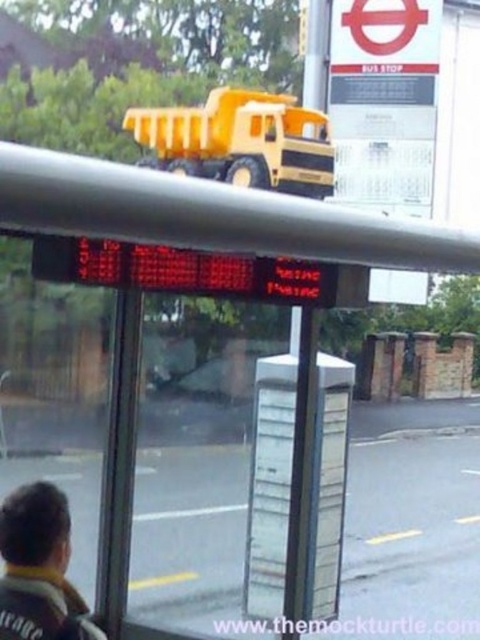
Question: Which of the following is the closest to the observer?

Choices:
 (A) dark brown leather jacket at lower left
 (B) yellow matte toy truck at upper center

Answer: (A)

Question: In this image, where is yellow matte toy truck at upper center located relative to dark brown leather jacket at lower left?

Choices:
 (A) right
 (B) left

Answer: (A)

Question: Which object is closer to the camera taking this photo?

Choices:
 (A) dark brown leather jacket at lower left
 (B) yellow matte toy truck at upper center

Answer: (A)

Question: Can you confirm if yellow matte toy truck at upper center is wider than dark brown leather jacket at lower left?

Choices:
 (A) yes
 (B) no

Answer: (A)

Question: Which of the following is the closest to the observer?

Choices:
 (A) yellow matte toy truck at upper center
 (B) dark brown leather jacket at lower left

Answer: (B)

Question: Can you confirm if yellow matte toy truck at upper center is wider than dark brown leather jacket at lower left?

Choices:
 (A) no
 (B) yes

Answer: (B)